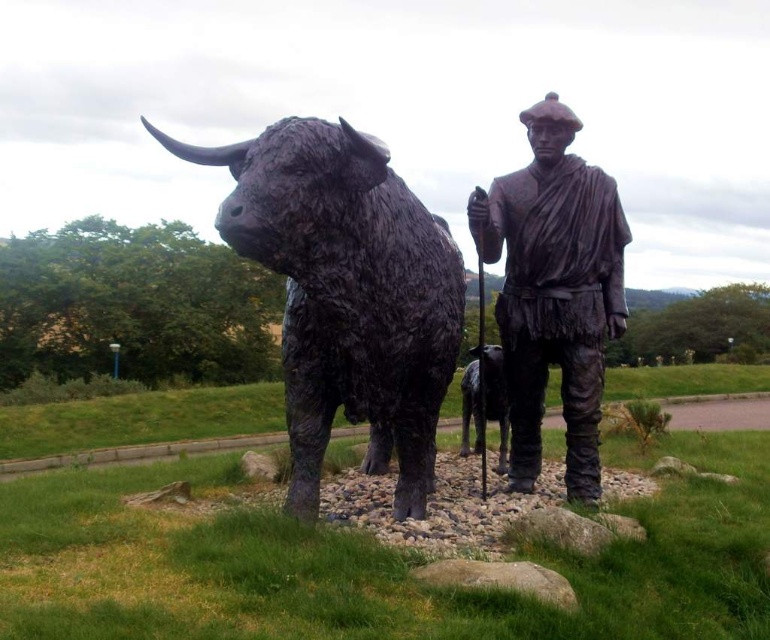
You are an art student analyzing the sculpture. You notice the black textured bull at center and the bronze statue at center. Which of these two figures has a greater width?

The black textured bull at center has a greater width than the bronze statue at center according to the description.

You are standing in the park and see the black textured bull at center and the shiny black dog at center. Which one is closer to you?

The black textured bull at center is closer to the viewer than the shiny black dog at center.

You are an art student analyzing the sculpture in the park. You notice two figures at the center of the sculpture. Which one is taller between the black textured bull at center and the shiny black dog at center?

The black textured bull at center is taller than the shiny black dog at center.